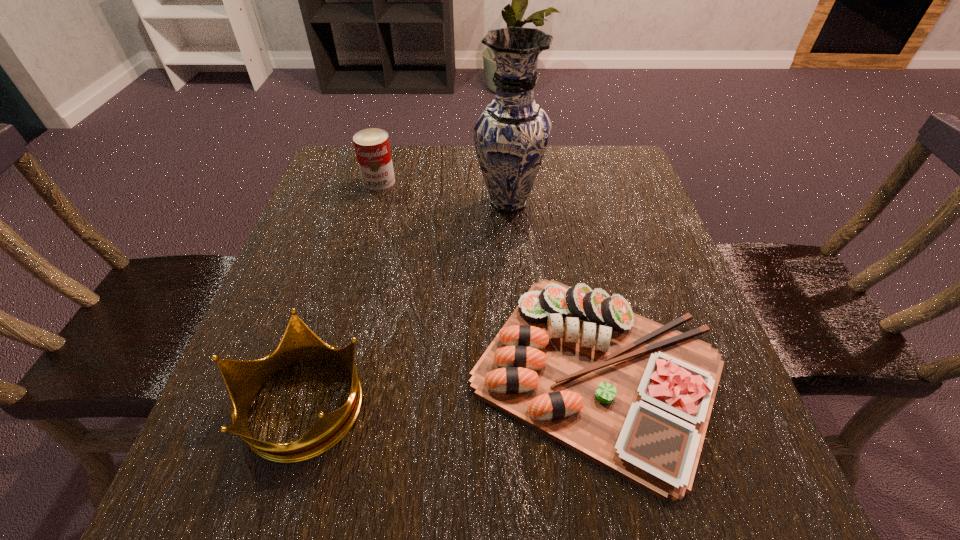
Image resolution: width=960 pixels, height=540 pixels. I want to click on free space between the tallest object and the crown, so click(405, 303).

Where is `vacant region between the vase and the crown`? The image size is (960, 540). vacant region between the vase and the crown is located at coordinates (405, 303).

Where is `free area in between the shortest object and the can`? This screenshot has width=960, height=540. free area in between the shortest object and the can is located at coordinates (x=488, y=276).

The image size is (960, 540). I want to click on unoccupied position between the crown and the can, so click(x=341, y=292).

At what (x,y) coordinates should I click in order to perform the action: click on free space between the can and the platter. Please return your answer as a coordinate pair (x, y). The width and height of the screenshot is (960, 540). Looking at the image, I should click on (488, 276).

Locate an element on the screen. This screenshot has width=960, height=540. free space between the shortest object and the can is located at coordinates tap(488, 276).

Choose which object is the second nearest neighbor to the crown. Please provide its 2D coordinates. Your answer should be formatted as a tuple, i.e. [(x, y)], where the tuple contains the x and y coordinates of a point satisfying the conditions above.

[(511, 135)]

Identify the location of object identified as the closest to the can. (511, 135).

Locate an element on the screen. Image resolution: width=960 pixels, height=540 pixels. blank space that satisfies the following two spatial constraints: 1. on the front label of the vase; 2. on the right side of the can is located at coordinates (373, 202).

You are a GUI agent. You are given a task and a screenshot of the screen. Output one action in this format:
    pyautogui.click(x=<x>, y=<y>)
    Task: Click on the vacant space that satisfies the following two spatial constraints: 1. on the back side of the crown; 2. on the left side of the tallest object
    Image resolution: width=960 pixels, height=540 pixels.
    Given the screenshot: What is the action you would take?
    pyautogui.click(x=363, y=202)